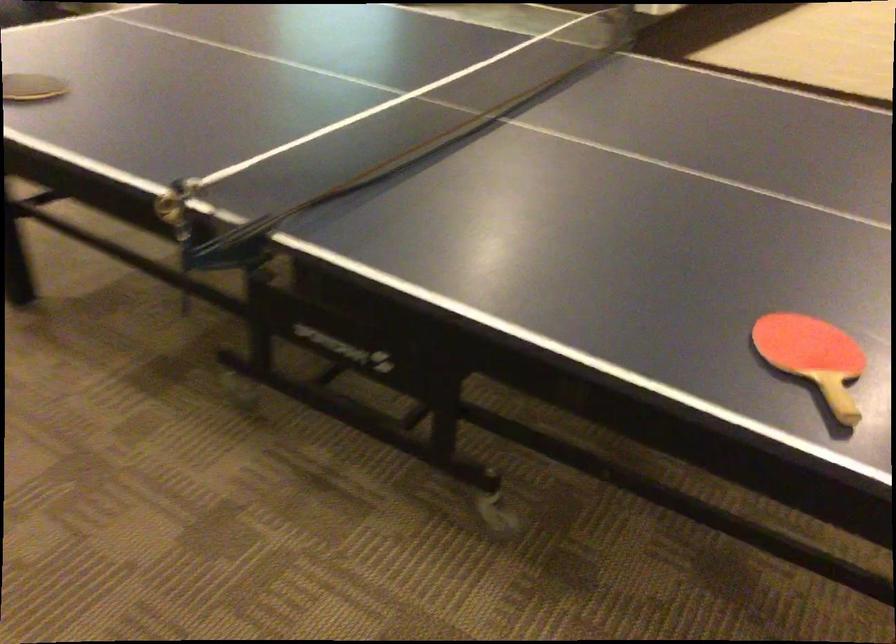
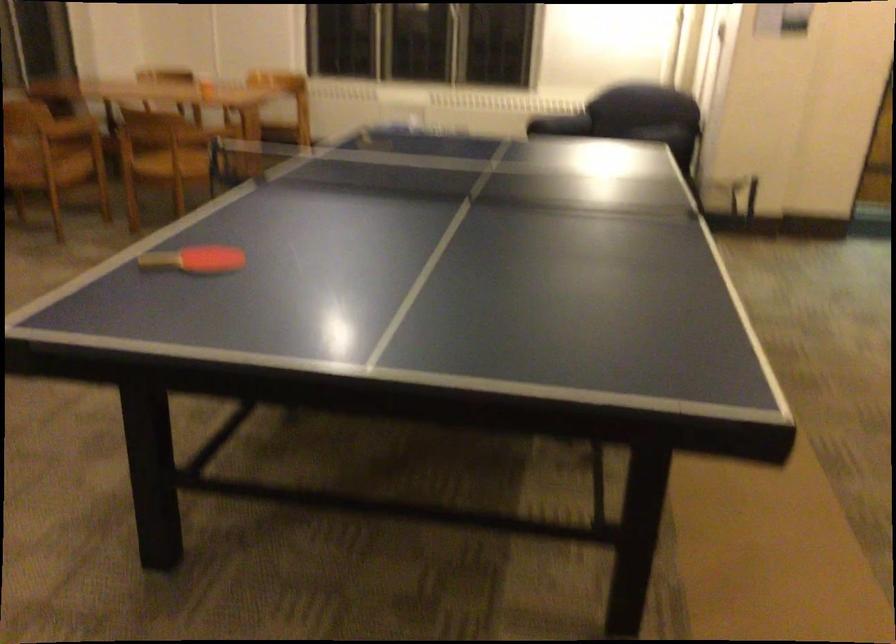
Where in the second image is the point corresponding to (810,325) from the first image?

(194, 259)